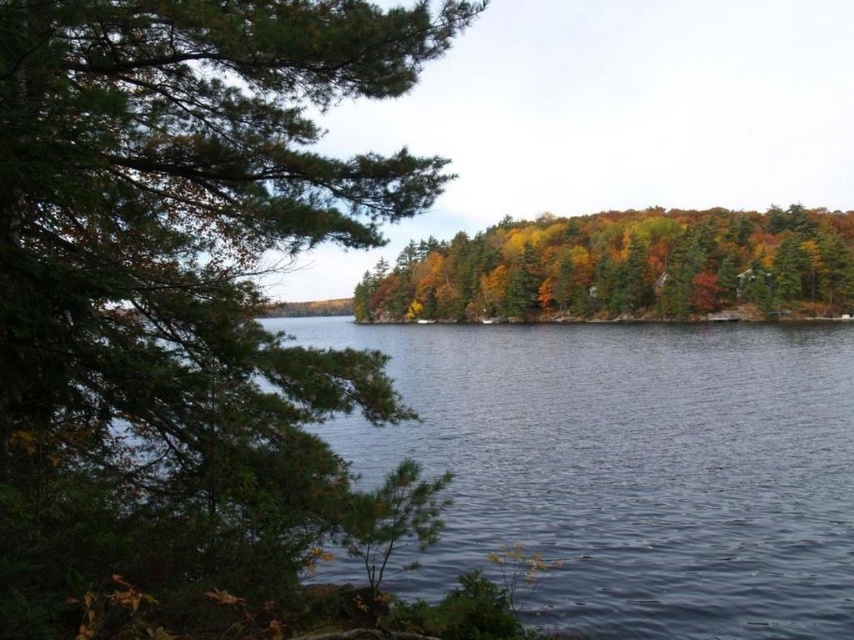
Which is behind, point (148, 464) or point (653, 241)?

The point (653, 241) is behind.

Who is shorter, green matte tree at left or autumn leaves at center?

Standing shorter between the two is green matte tree at left.

Identify the location of green matte tree at left. The width and height of the screenshot is (854, 640). (179, 282).

You are a GUI agent. You are given a task and a screenshot of the screen. Output one action in this format:
    pyautogui.click(x=<x>, y=<y>)
    Task: Click on the green matte tree at left
    
    Given the screenshot: What is the action you would take?
    pyautogui.click(x=179, y=282)